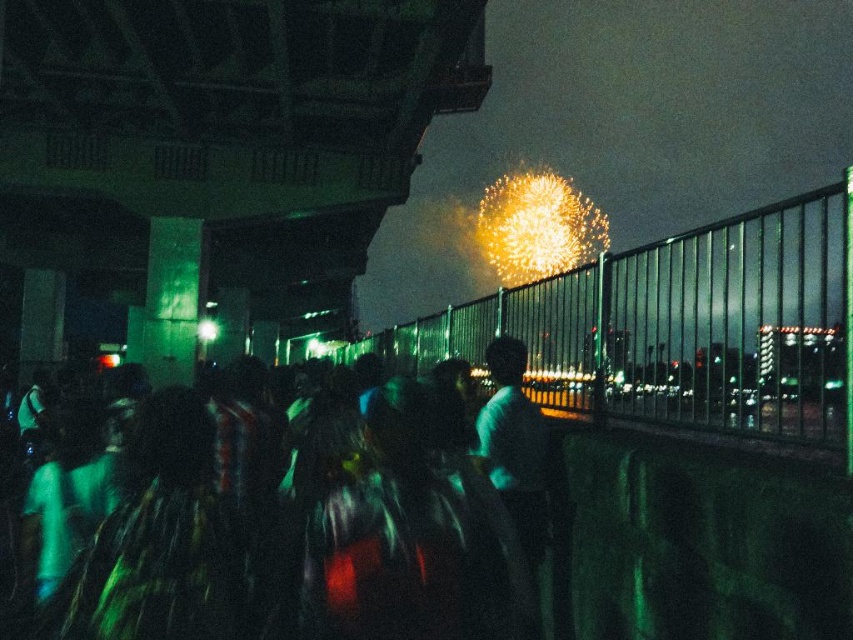
You are a photographer trying to capture the fireworks display in the distance. You notice the metallic fence at upper center and the dark matte crowd at center in your shot. Which object in your viewfinder takes up more horizontal space?

The metallic fence at upper center takes up more horizontal space because its width is larger than that of the dark matte crowd at center.

You are standing in the crowd watching fireworks. There are two points marked in the image. The first point is at coordinate point (793,369) and the second point is at coordinate point (387,396). Which point is closer to you?

Point (387,396) is closer to you because point (793,369) is behind it.